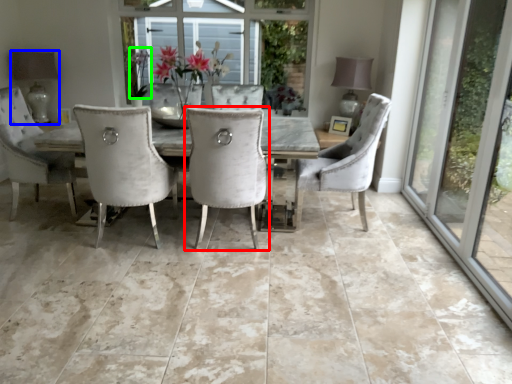
Question: Which object is the farthest from chair (highlighted by a red box)? Choose among these: lamp (highlighted by a blue box) or plant (highlighted by a green box).

Choices:
 (A) lamp
 (B) plant

Answer: (A)